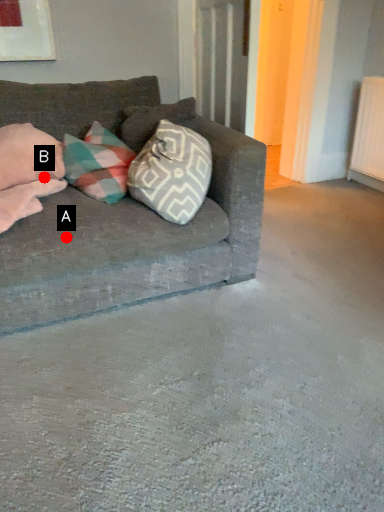
Question: Two points are circled on the image, labeled by A and B beside each circle. Which of the following is the closest to the observer?

Choices:
 (A) A is closer
 (B) B is closer

Answer: (A)